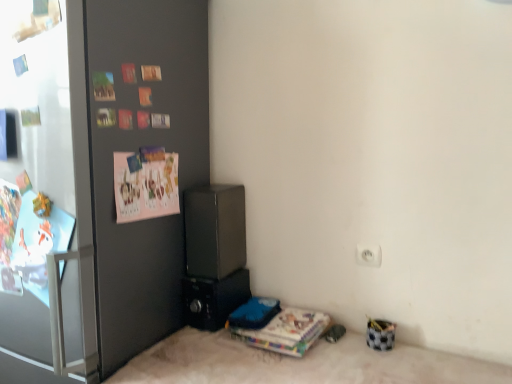
This screenshot has width=512, height=384. What are the coordinates of `free space in front of black plastic speaker at lower center, positioned as the 1th appliance in bottom-to-top order` in the screenshot? It's located at (201, 352).